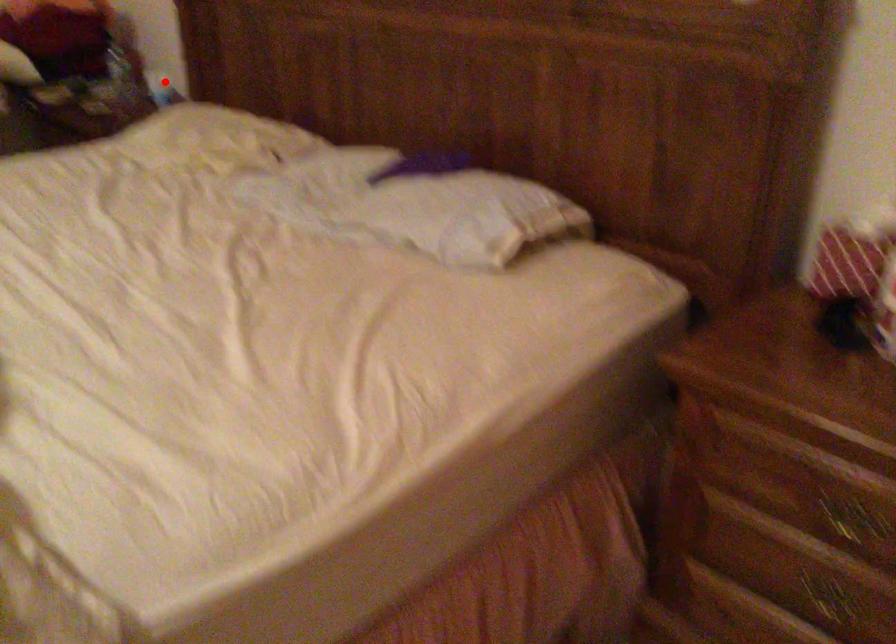
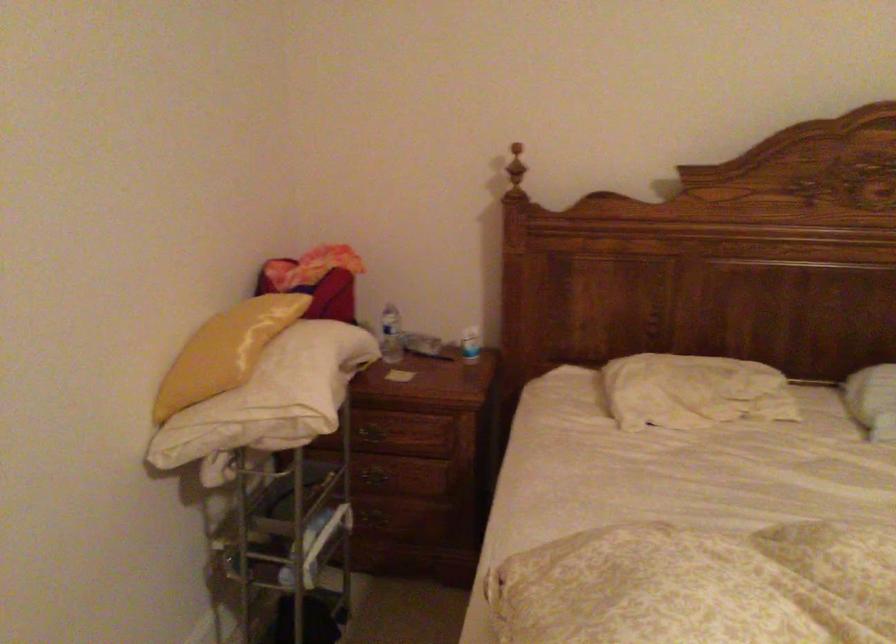
Locate, in the second image, the point that corresponds to the highlighted location in the first image.

(470, 344)